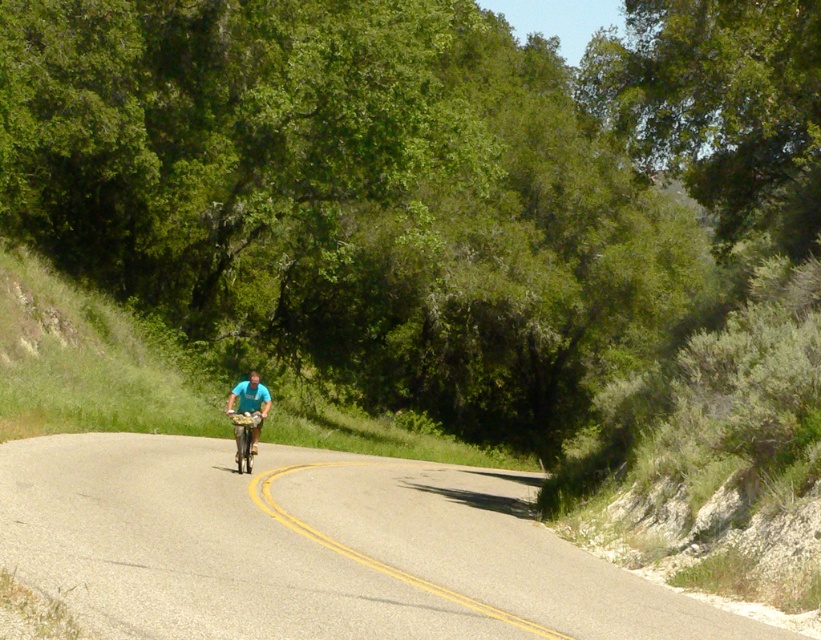
You are a drone operator trying to locate a specific point on the gray asphalt road at center. The point has coordinates of point [310,547]. Based on the scene description, can you confirm if this point is on the road?

Yes, the point [310,547] is on the gray asphalt road at center according to the description.

You are a pedestrian standing at the edge of the gray asphalt road at center and want to cross to the other side. The shiny metallic bicycle at center is approaching from behind you. Which direction should you cross to avoid the bicycle?

The gray asphalt road at center is in front of shiny metallic bicycle at center, so the bicycle is behind you. To avoid it, cross directly in front of the bicycle towards the opposite side of the road.

From the picture: You are a cyclist on the road and you see two points marked on the road ahead of you. The first point is at coordinates point (x=237, y=384) and the second point is at point (x=244, y=452). Which point should you reach first as you continue moving forward?

You will reach point (x=244, y=452) first because it is in front of point (x=237, y=384), which is behind it according to the description.